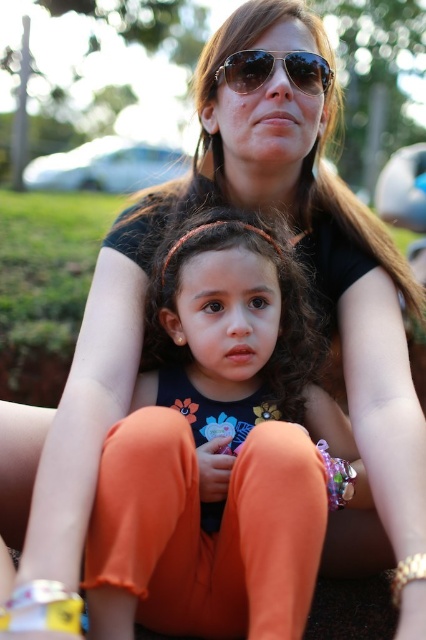
You are a photographer adjusting the lighting for a portrait. You notice the orange fabric pants at center and the metallic aviator sunglasses at center in the scene. Which object is closer to the camera?

The orange fabric pants at center are positioned under the metallic aviator sunglasses at center, so the metallic aviator sunglasses at center are closer to the camera.

You are a jeweler examining two bracelets in the image. The white fabric bracelet at lower left and the metallic gold bracelet at lower right. Which bracelet is bigger in size?

The white fabric bracelet at lower left is larger in size compared to the metallic gold bracelet at lower right.